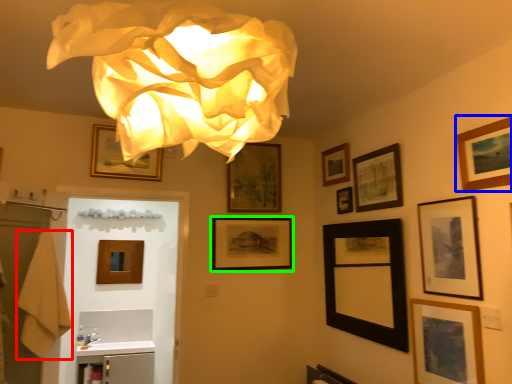
Question: Which is farther away from bath towel (highlighted by a red box)? picture frame (highlighted by a blue box) or picture frame (highlighted by a green box)?

Choices:
 (A) picture frame
 (B) picture frame

Answer: (A)